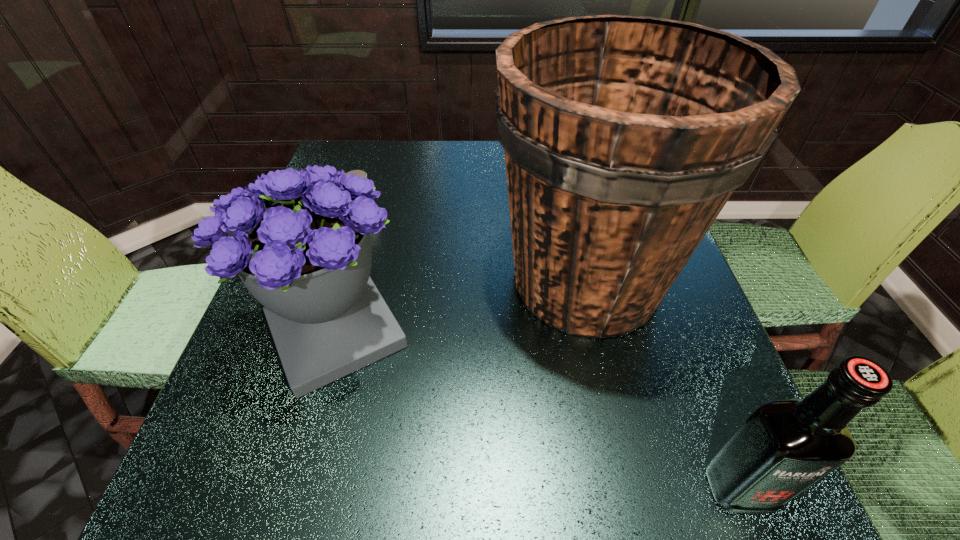
Point out which object is positioned as the nearest to the bouquet. Please provide its 2D coordinates. Your answer should be formatted as a tuple, i.e. [(x, y)], where the tuple contains the x and y coordinates of a point satisfying the conditions above.

[(624, 137)]

Where is `the third closest object to the bucket`? The image size is (960, 540). the third closest object to the bucket is located at coordinates (361, 173).

This screenshot has height=540, width=960. I want to click on free space that satisfies the following two spatial constraints: 1. on the label side of the tallest object; 2. on the right side of the shortest object, so click(345, 280).

This screenshot has width=960, height=540. Find the location of `free region that satisfies the following two spatial constraints: 1. on the back side of the bouquet; 2. on the right side of the tallest object`. free region that satisfies the following two spatial constraints: 1. on the back side of the bouquet; 2. on the right side of the tallest object is located at coordinates (350, 280).

You are a GUI agent. You are given a task and a screenshot of the screen. Output one action in this format:
    pyautogui.click(x=<x>, y=<y>)
    Task: Click on the vacant space that satisfies the following two spatial constraints: 1. on the label side of the bouquet; 2. on the left side of the shortest object
    This screenshot has height=540, width=960.
    Given the screenshot: What is the action you would take?
    pyautogui.click(x=329, y=332)

At what (x,y) coordinates should I click in order to perform the action: click on vacant space that satisfies the following two spatial constraints: 1. on the label side of the jam; 2. on the left side of the bouquet. Please return your answer as a coordinate pair (x, y). Looking at the image, I should click on (329, 332).

Locate an element on the screen. blank area in the image that satisfies the following two spatial constraints: 1. on the label side of the bucket; 2. on the right side of the jam is located at coordinates 345,280.